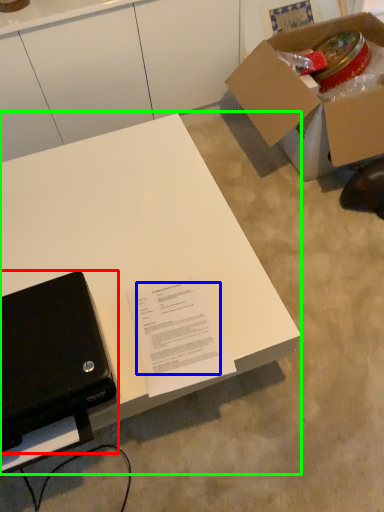
Question: Which is farther away from laptop (highlighted by a red box)? writing (highlighted by a blue box) or desk (highlighted by a green box)?

Choices:
 (A) writing
 (B) desk

Answer: (B)